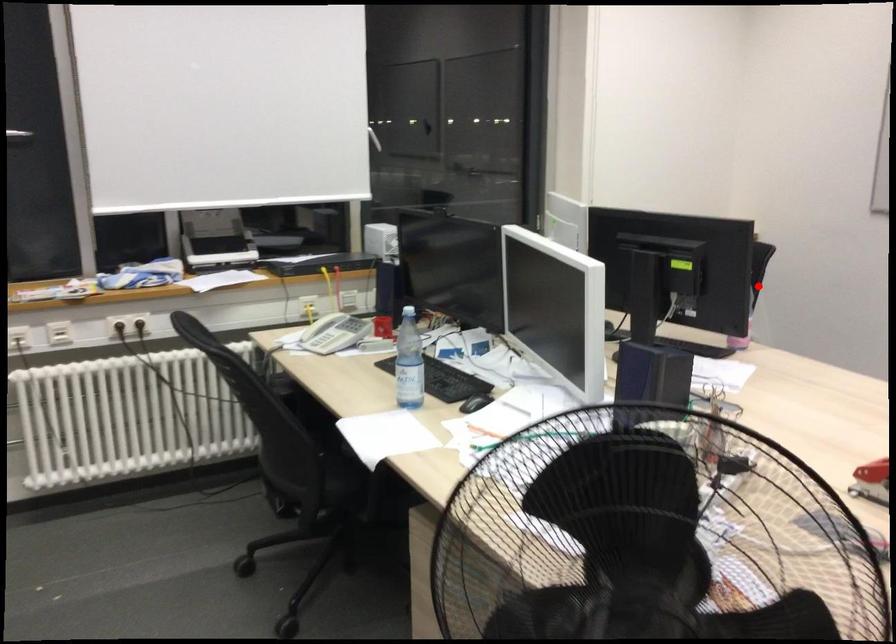
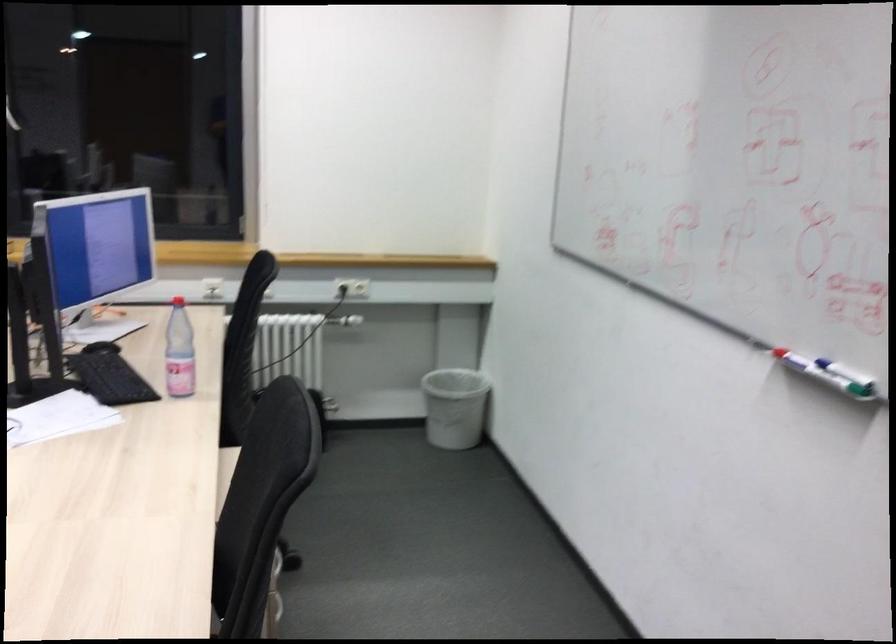
Find the pixel in the second image that matches the highlighted location in the first image.

(246, 319)